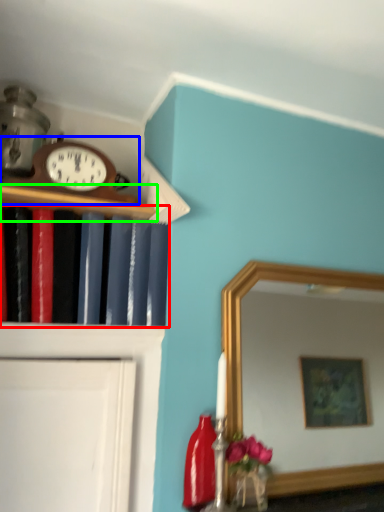
Question: Which object is positioned farthest from book (highlighted by a red box)? Select from wall clock (highlighted by a blue box) and shelf (highlighted by a green box).

Choices:
 (A) wall clock
 (B) shelf

Answer: (A)